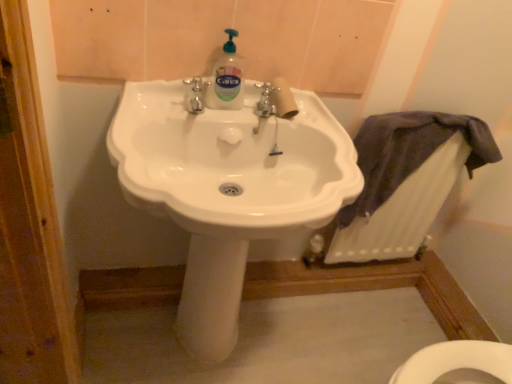
Image resolution: width=512 pixels, height=384 pixels. In order to click on vacant region below white glossy sink at center (from a real-world perspective) in this screenshot , I will do `click(194, 357)`.